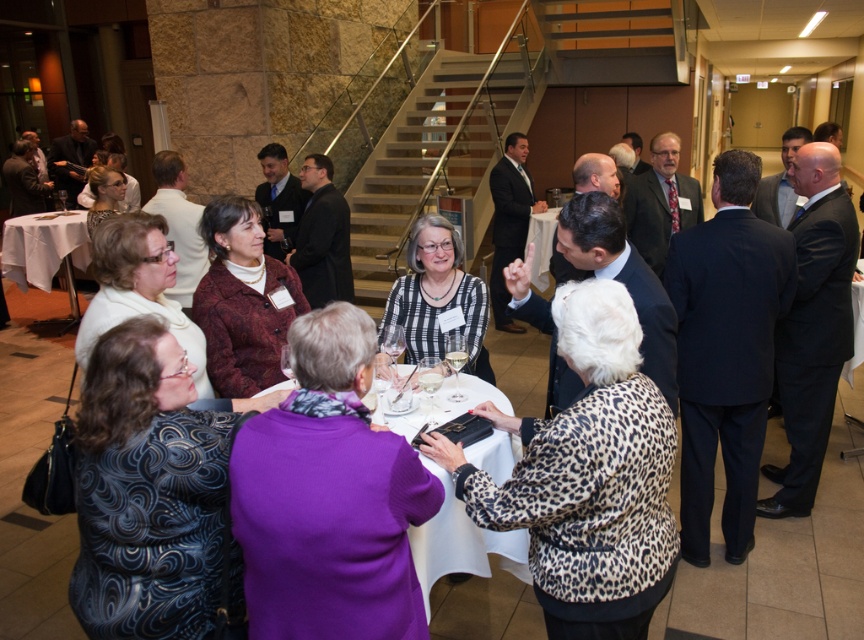
You are at a social event in a modern hall with a round table covered in a white tablecloth. You notice a point at coordinates (x=461, y=544). What is located at that point?

The point at (x=461, y=544) has the white cloth at center.

You are standing in the conference hall and want to reach the point marked at coordinates [475,560]. If you take a step forward of 2 feet, how many more feet do you need to move to reach the point?

The point is 7.30 feet away from the viewer. After taking a 2 feet step forward, you still need to move 5.30 feet to reach the point.

You are planning to set up a buffet for an event and need to know which surface has more space available for placing food items. Based on the image, which object between the white cloth at center and the white cloth table at lower left would allow you to place more food items?

The white cloth table at lower left has more space available because it occupies more space than the white cloth at center.